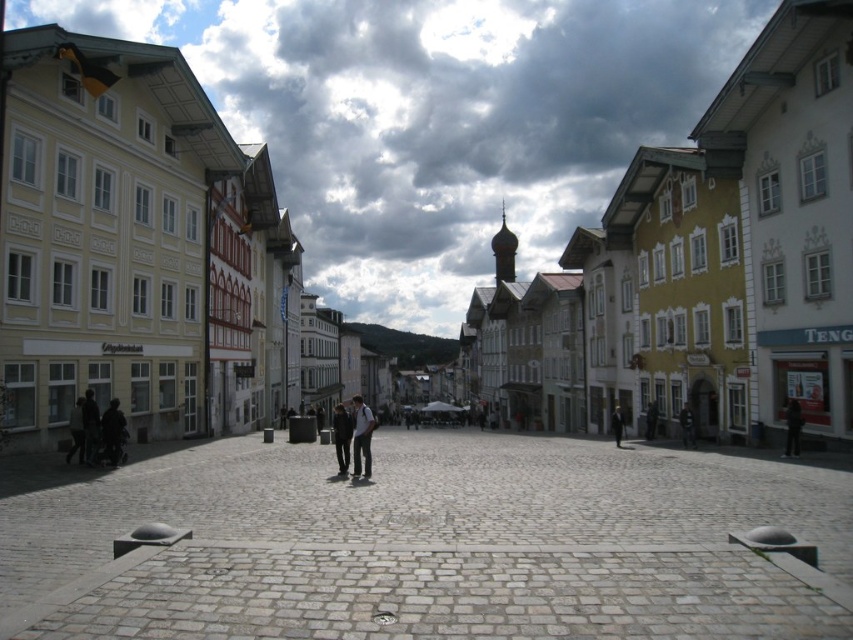
Between point (357, 397) and point (86, 451), which one is positioned in front?

Point (86, 451) is more forward.

Can you confirm if dark gray pants at center is bigger than dark gray suit at left?

Indeed, dark gray pants at center has a larger size compared to dark gray suit at left.

Is point (363, 410) positioned after point (88, 461)?

Yes, point (363, 410) is behind point (88, 461).

The width and height of the screenshot is (853, 640). Find the location of `dark gray pants at center`. dark gray pants at center is located at coordinates (361, 436).

Can you confirm if dark gray fabric jacket at lower left is positioned to the right of dark blue suit at center?

No, dark gray fabric jacket at lower left is not to the right of dark blue suit at center.

Can you confirm if dark gray fabric jacket at lower left is positioned above dark blue suit at center?

Yes.

Which is behind, point (79, 454) or point (619, 436)?

Point (619, 436)

Where is `dark gray fabric jacket at lower left`? The image size is (853, 640). dark gray fabric jacket at lower left is located at coordinates (76, 432).

Between dark gray fabric jacket at lower left and dark brown leather jacket at center, which one appears on the right side from the viewer's perspective?

Positioned to the right is dark brown leather jacket at center.

Measure the distance between dark gray fabric jacket at lower left and camera.

dark gray fabric jacket at lower left and camera are 224.82 feet apart from each other.

Locate an element on the screen. The height and width of the screenshot is (640, 853). dark gray fabric jacket at lower left is located at coordinates (76, 432).